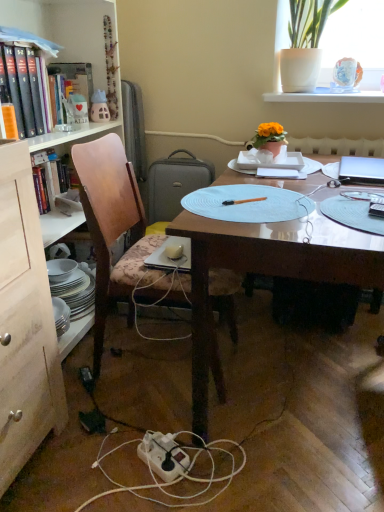
I want to click on free region on the left part of black plastic power plugs and sockets at lower left, which appears as the 1th power plugs and sockets when viewed from the back, so click(69, 378).